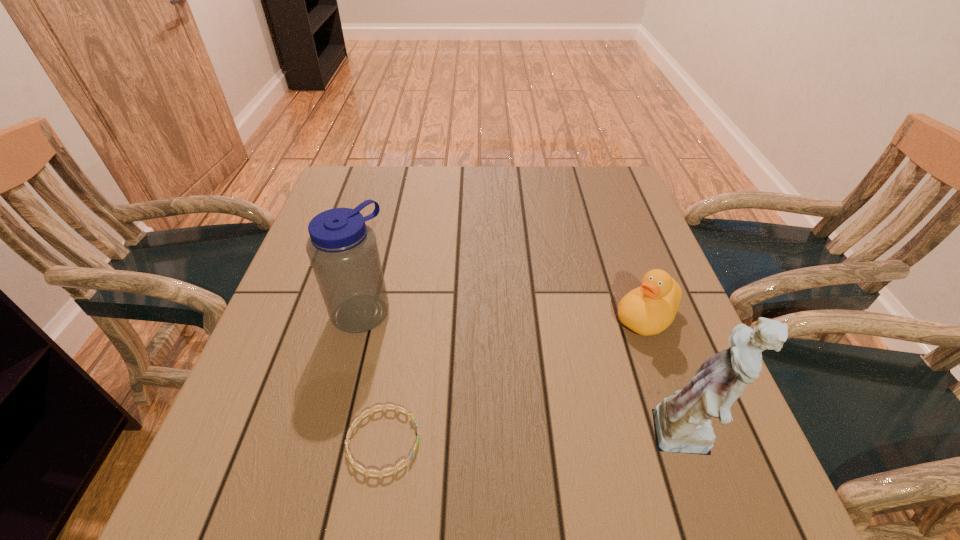
In order to click on bracelet in this screenshot , I will do `click(379, 473)`.

Where is `the tallest object`? the tallest object is located at coordinates (682, 424).

You are a GUI agent. You are given a task and a screenshot of the screen. Output one action in this format:
    pyautogui.click(x=<x>, y=<y>)
    Task: Click on the water bottle
    The width and height of the screenshot is (960, 540).
    Given the screenshot: What is the action you would take?
    click(342, 249)

You are a GUI agent. You are given a task and a screenshot of the screen. Output one action in this format:
    pyautogui.click(x=<x>, y=<y>)
    Task: Click on the duck
    
    Given the screenshot: What is the action you would take?
    pyautogui.click(x=647, y=310)

This screenshot has height=540, width=960. What are the coordinates of `vacant space situated on the surface of the bracelet showing star-shaped elements` in the screenshot? It's located at (648, 441).

Locate an element on the screen. The image size is (960, 540). vacant space located with a carrying loop on the side of the water bottle is located at coordinates (465, 407).

Where is `vacant area situated 0.270m with a carrying loop on the side of the water bottle`? The image size is (960, 540). vacant area situated 0.270m with a carrying loop on the side of the water bottle is located at coordinates tap(468, 410).

I want to click on vacant space situated 0.280m with a carrying loop on the side of the water bottle, so [x=472, y=414].

You are a GUI agent. You are given a task and a screenshot of the screen. Output one action in this format:
    pyautogui.click(x=<x>, y=<y>)
    Task: Click on the free space located on the face of the duck
    This screenshot has height=540, width=960.
    Given the screenshot: What is the action you would take?
    pyautogui.click(x=518, y=436)

Identify the location of vacant space located on the face of the duck. The height and width of the screenshot is (540, 960). (563, 394).